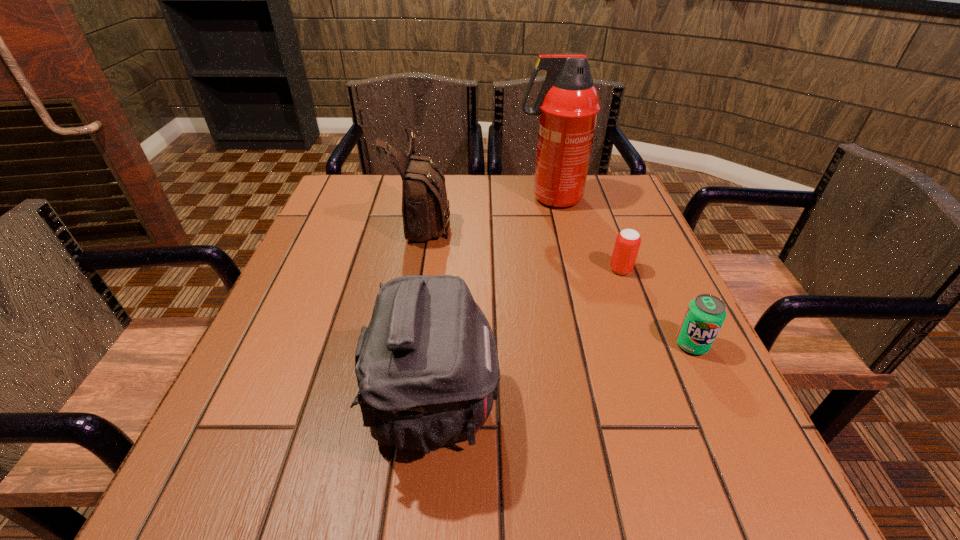
This screenshot has width=960, height=540. In order to click on vacant region located 0.200m on the front-facing side of the farther shoulder bag in this screenshot , I will do `click(531, 221)`.

Identify the location of free space located on the open flap of the nearer shoulder bag. (537, 407).

In order to click on free space located on the front-facing side of the rightmost object in this screenshot , I will do pos(743,454).

Locate an element on the screen. vacant region located 0.360m on the front of the third nearest object is located at coordinates (681, 429).

At what (x,y) coordinates should I click in order to perform the action: click on fire extinguisher located at the far edge. Please return your answer as a coordinate pair (x, y). This screenshot has width=960, height=540. Looking at the image, I should click on tap(568, 104).

This screenshot has width=960, height=540. I want to click on shoulder bag that is at the far edge, so click(x=425, y=207).

This screenshot has height=540, width=960. In order to click on object situated at the near edge in this screenshot , I will do `click(427, 368)`.

What are the coordinates of `fire extinguisher positioned at the right edge` in the screenshot? It's located at (568, 104).

Where is `pop soda that is at the right edge`? pop soda that is at the right edge is located at coordinates (704, 317).

You are a GUI agent. You are given a task and a screenshot of the screen. Output one action in this format:
    pyautogui.click(x=<x>, y=<y>)
    Task: Click on the beer can that is at the right edge
    The image size is (960, 540).
    Given the screenshot: What is the action you would take?
    pyautogui.click(x=628, y=241)